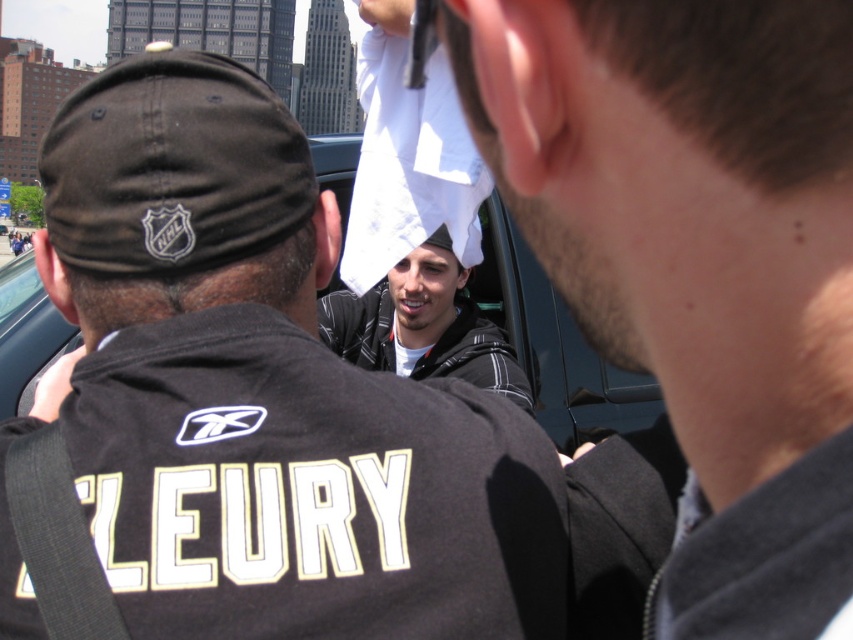
Question: Is black matte car at center positioned in front of white cotton towel at center?

Choices:
 (A) no
 (B) yes

Answer: (B)

Question: Which point is closer to the camera taking this photo?

Choices:
 (A) (178, 218)
 (B) (450, 288)

Answer: (A)

Question: Which object is positioned farthest from the black matte car at center?

Choices:
 (A) white cotton towel at center
 (B) white paper towel at center
 (C) black fabric baseball cap at upper center

Answer: (C)

Question: Observing the image, what is the correct spatial positioning of white paper towel at center in reference to black matte car at center?

Choices:
 (A) above
 (B) below

Answer: (B)

Question: Can you confirm if white paper towel at center is bigger than black matte car at center?

Choices:
 (A) yes
 (B) no

Answer: (A)

Question: Which point is farther from the camera taking this photo?

Choices:
 (A) (450, 358)
 (B) (227, 104)

Answer: (A)